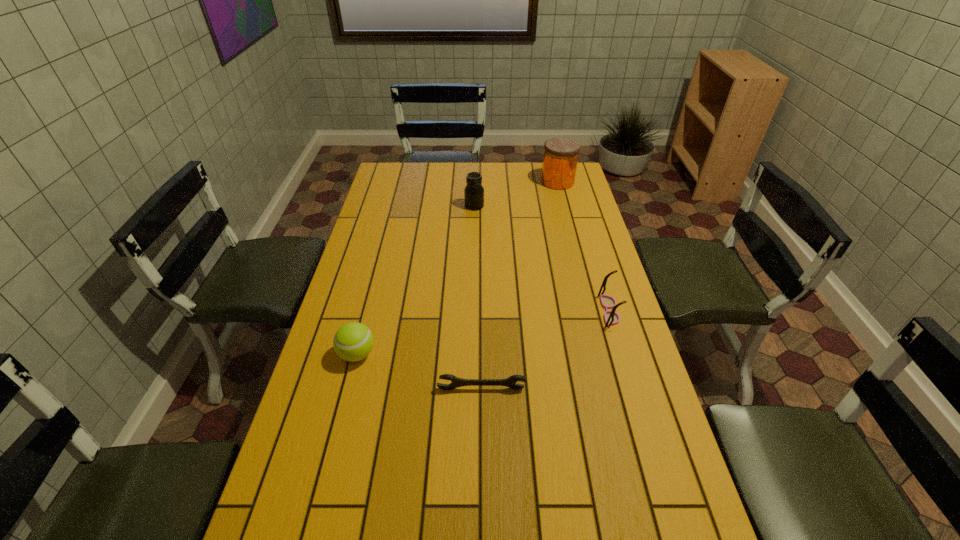
Where is `the taller jar`? The image size is (960, 540). the taller jar is located at coordinates (560, 159).

This screenshot has height=540, width=960. I want to click on the tallest object, so click(x=560, y=159).

Locate an element on the screen. Image resolution: width=960 pixels, height=540 pixels. the second tallest object is located at coordinates (474, 192).

Image resolution: width=960 pixels, height=540 pixels. Identify the location of the shorter jar. (474, 192).

Locate an element on the screen. spectacles is located at coordinates (611, 318).

Identify the location of tennis ball. (353, 341).

Where is `the leftmost object`? Image resolution: width=960 pixels, height=540 pixels. the leftmost object is located at coordinates (353, 341).

Where is `the nearest object`? the nearest object is located at coordinates (456, 382).

This screenshot has height=540, width=960. I want to click on wrench, so click(x=456, y=382).

Locate an element on the screen. The width and height of the screenshot is (960, 540). vacant space located 0.080m on the left of the taller jar is located at coordinates (523, 181).